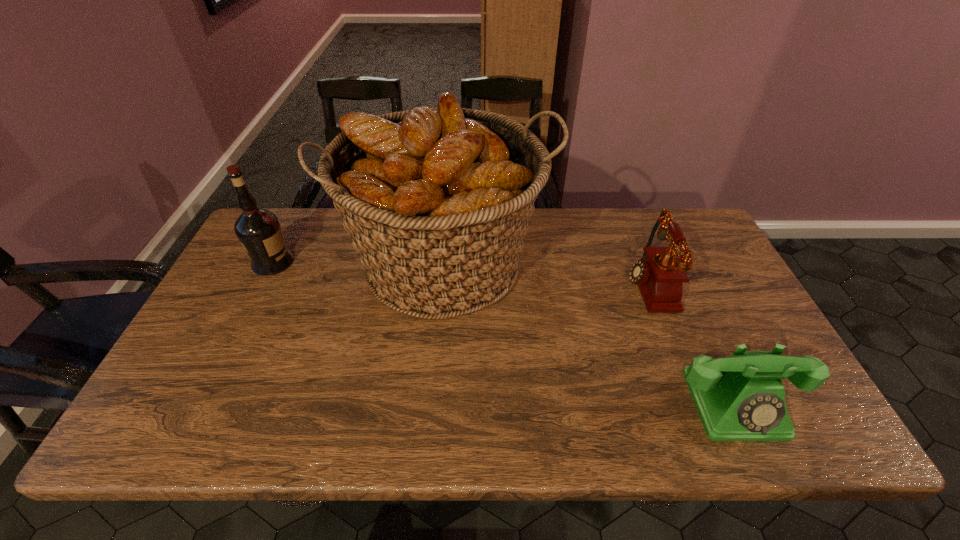
At what (x,y) coordinates should I click in order to perform the action: click on vacant space located 0.370m on the dial of the farther telephone. Please return your answer as a coordinate pair (x, y). This screenshot has width=960, height=540. Looking at the image, I should click on (495, 285).

Locate an element on the screen. The height and width of the screenshot is (540, 960). blank area located 0.240m on the dial of the farther telephone is located at coordinates (540, 285).

Where is `free space located 0.250m on the dial of the farther telephone`? This screenshot has height=540, width=960. free space located 0.250m on the dial of the farther telephone is located at coordinates (538, 285).

Identify the location of basket situated at the far edge. This screenshot has width=960, height=540. (437, 201).

Where is `liquor present at the far edge`? This screenshot has height=540, width=960. liquor present at the far edge is located at coordinates (258, 230).

I want to click on object that is positioned at the near edge, so click(739, 398).

Where is `object at the left edge`? object at the left edge is located at coordinates (258, 230).

Identify the location of object located at the right edge. (739, 398).

What are the coordinates of `object that is at the far left corner` in the screenshot? It's located at (258, 230).

Identify the location of object positioned at the near right corner. The height and width of the screenshot is (540, 960). (739, 398).